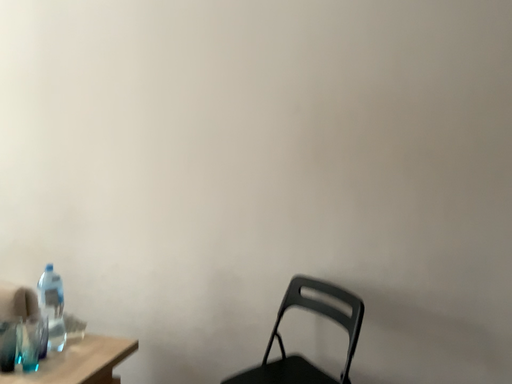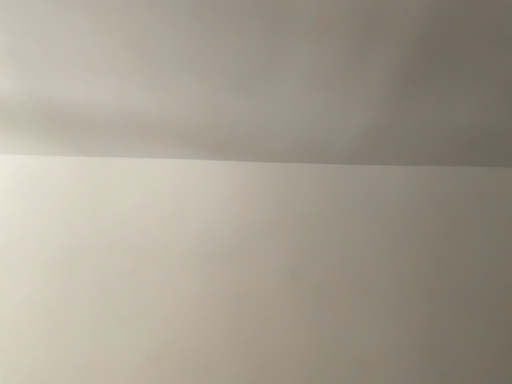
Question: Which way did the camera rotate in the video?

Choices:
 (A) rotated upward
 (B) rotated downward

Answer: (A)